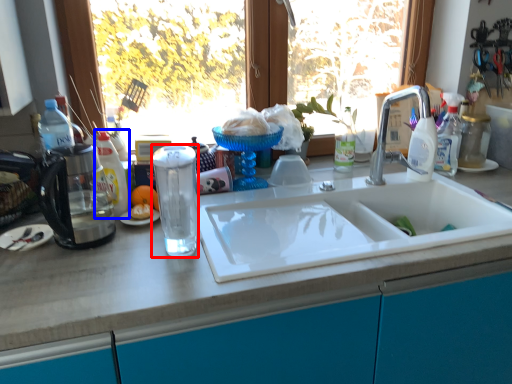
Question: Among these objects, which one is farthest to the camera, beverage (highlighted by a red box) or bottle (highlighted by a blue box)?

Choices:
 (A) beverage
 (B) bottle

Answer: (B)